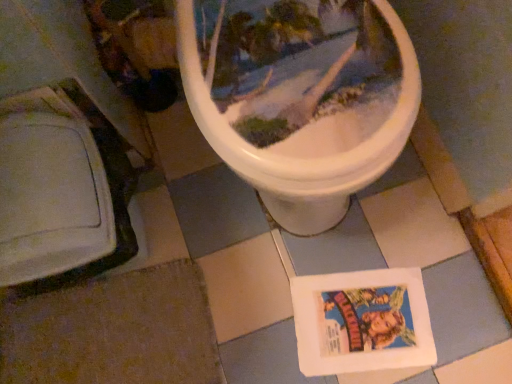
Identify the location of vacant space underneath brown fabric at lower left (from a real-world perspective). This screenshot has height=384, width=512. (120, 336).